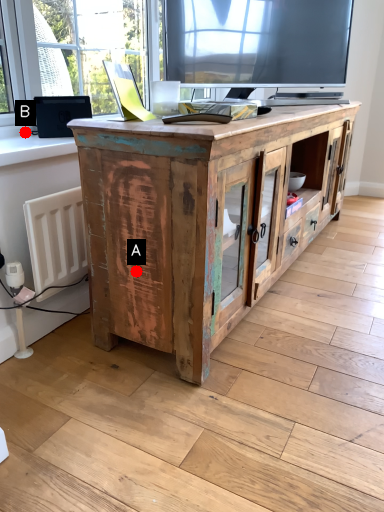
Question: Two points are circled on the image, labeled by A and B beside each circle. Which point appears closest to the camera in this image?

Choices:
 (A) A is closer
 (B) B is closer

Answer: (A)